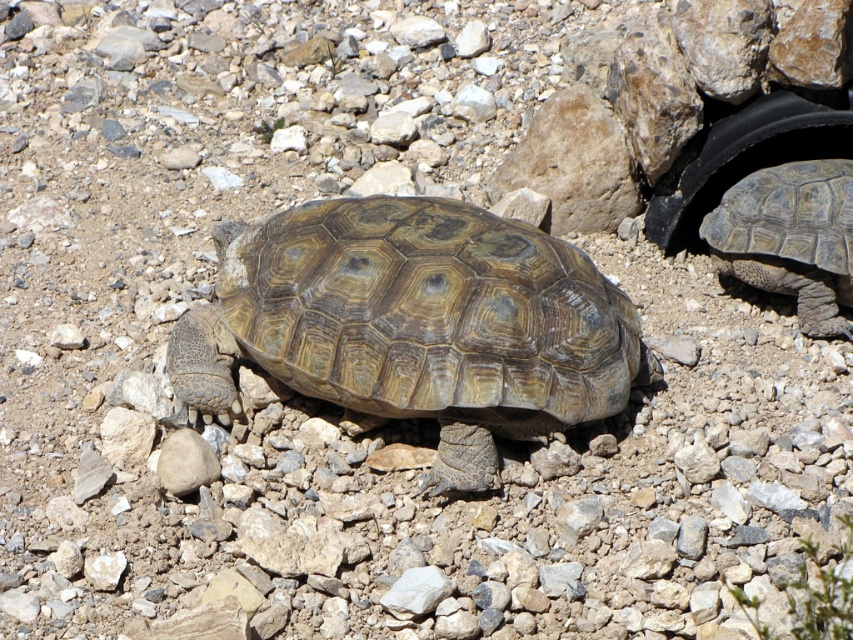
Question: Is the position of brown textured shell at center more distant than that of leathery brown tortoise at right?

Choices:
 (A) yes
 (B) no

Answer: (B)

Question: Based on their relative distances, which object is farther from the brown textured shell at center?

Choices:
 (A) leathery brown tortoise at right
 (B) black rubber tire at upper right

Answer: (B)

Question: Estimate the real-world distances between objects in this image. Which object is closer to the brown textured shell at center?

Choices:
 (A) leathery brown tortoise at right
 (B) black rubber tire at upper right

Answer: (A)

Question: Among these points, which one is nearest to the camera?

Choices:
 (A) (729, 212)
 (B) (740, 144)

Answer: (A)

Question: Does leathery brown tortoise at right appear on the right side of black rubber tire at upper right?

Choices:
 (A) no
 (B) yes

Answer: (B)

Question: Does brown textured shell at center appear over leathery brown tortoise at right?

Choices:
 (A) yes
 (B) no

Answer: (B)